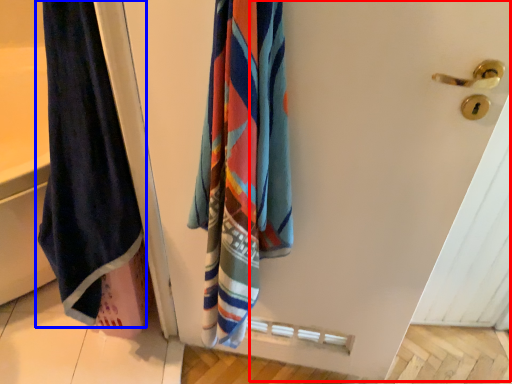
Question: Among these objects, which one is farthest to the camera, screen door (highlighted by a red box) or towel (highlighted by a blue box)?

Choices:
 (A) screen door
 (B) towel

Answer: (B)